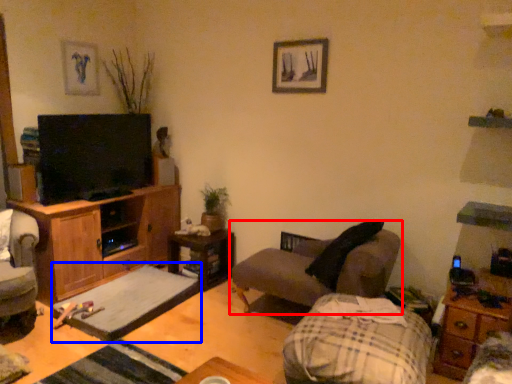
Question: Which object appears closest to the camera in this image, studio couch (highlighted by a red box) or footrest (highlighted by a blue box)?

Choices:
 (A) studio couch
 (B) footrest

Answer: (A)